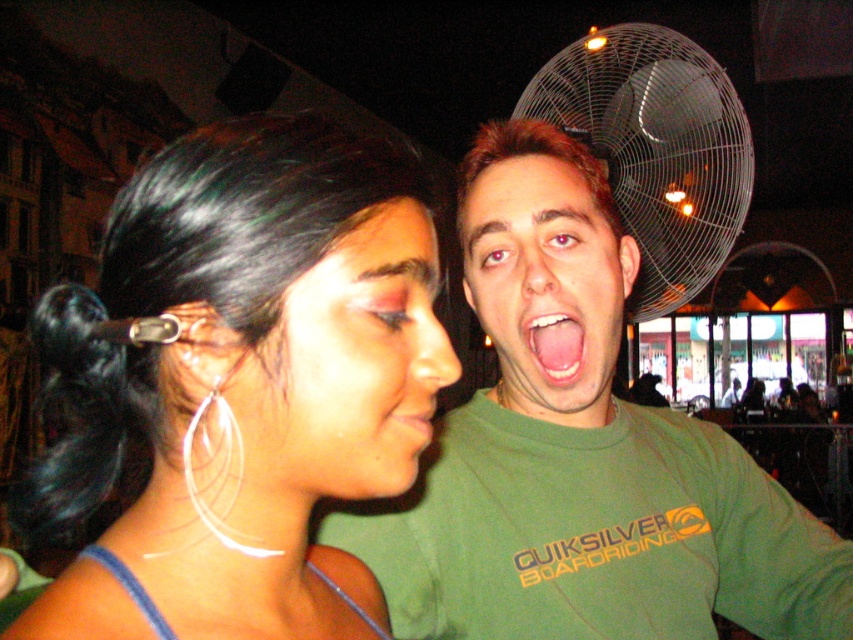
Question: Is matte pink eye shadow at center above green matte shirt at center?

Choices:
 (A) no
 (B) yes

Answer: (A)

Question: Which object appears farthest from the camera in this image?

Choices:
 (A) matte pink lips at center
 (B) shiny silver hoop earring at upper left

Answer: (A)

Question: From the image, what is the correct spatial relationship of green matte shirt at center in relation to matte pink lips at center?

Choices:
 (A) above
 (B) below

Answer: (A)

Question: Can you confirm if green matte shirt at center is thinner than pink glossy tongue at center?

Choices:
 (A) no
 (B) yes

Answer: (A)

Question: Which point is farther from the camera taking this photo?

Choices:
 (A) (537, 317)
 (B) (433, 412)
 (C) (154, 324)

Answer: (B)

Question: Which of the following is the closest to the observer?

Choices:
 (A) matte pink lips at center
 (B) black metallic fan at upper right
 (C) green matte shirt at center
 (D) matte pink eye shadow at center

Answer: (D)